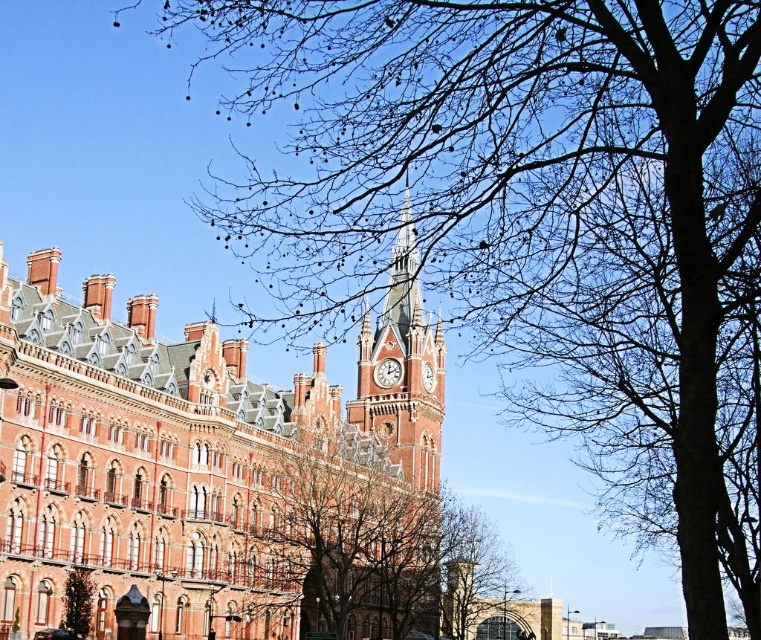
You are standing in front of the historic building and notice the bare branches at center. Can you determine their exact position relative to the building?

The bare branches at center are located at coordinates point (x=361, y=541), which places them in the foreground near the lower central part of the image.

You are standing in front of the historic building and want to take a photo that includes both the bare branches at center and the red brick clock tower at center. Which object will appear larger in the photo?

The bare branches at center will appear larger in the photo because they are closer to the viewer than the red brick clock tower at center.

You are an architect analyzing the building structure. Which object between the red brick clock tower at center and the polished brass clock at center is taller?

The red brick clock tower at center is much taller than the polished brass clock at center.